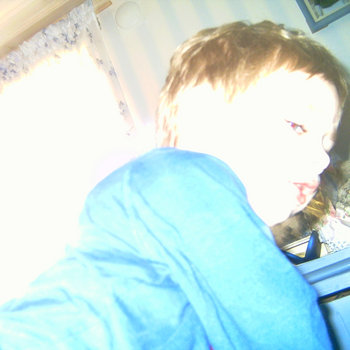
Find the location of `lace window curtain`. lace window curtain is located at coordinates (88, 45).